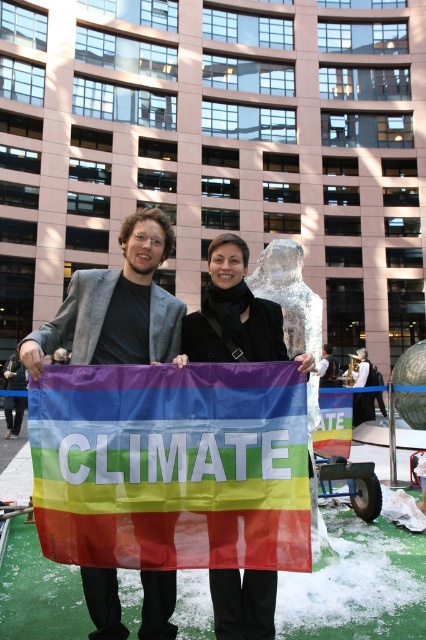
You are a photographer standing in front of the building and want to capture a photo of the rainbow fabric flag at center and the matte black jacket at center. Which object is wider in the image?

The rainbow fabric flag at center is wider than the matte black jacket at center.